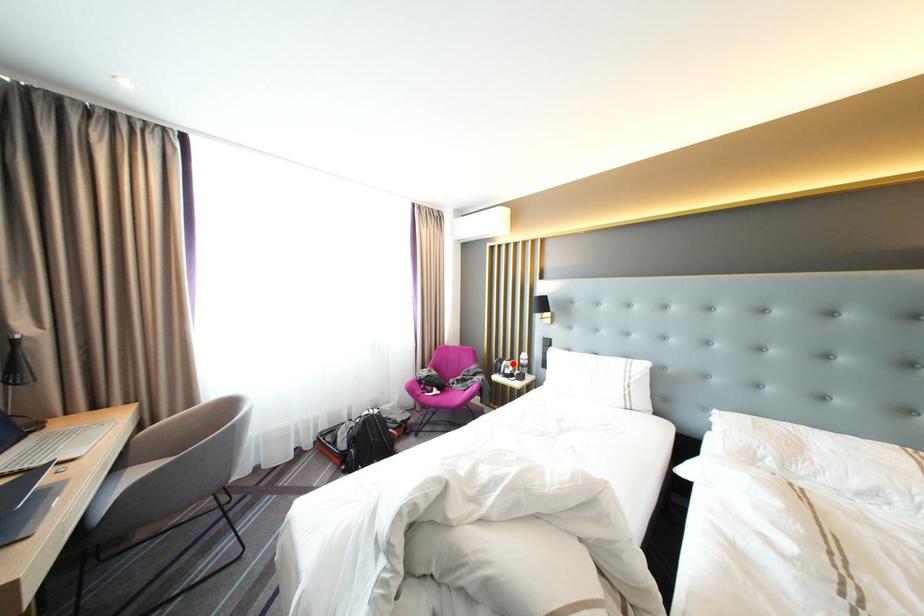
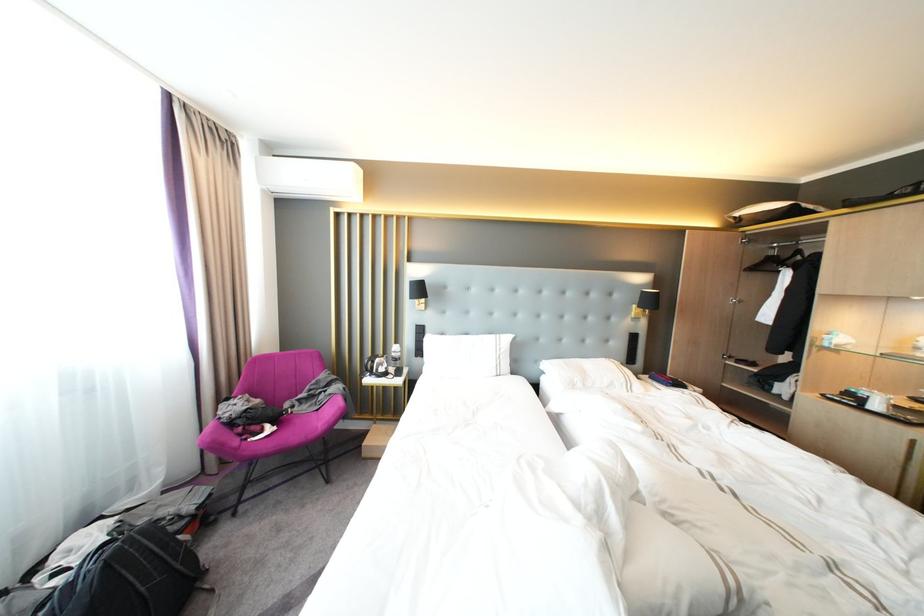
Where in the second image is the point corresponding to the highlighted location from the first image?

(384, 363)